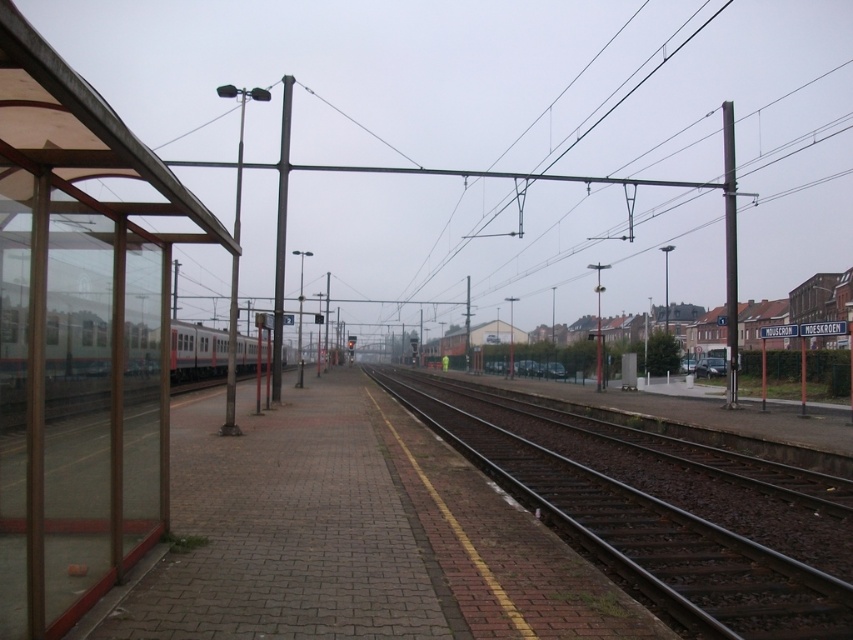
You are standing at the point marked as point (196, 352) on the platform. What object is located at that point?

The point (196, 352) indicates the green matte passenger train at left.

You are a photographer standing on the railway station platform. You want to take a photo of both point (485, 458) and point (293, 80) in the image. Which point should you focus on first to ensure both points are in sharp focus?

You should focus on point (485, 458) first because it is closer to the camera than point (293, 80). This ensures the depth of field will cover both points effectively.